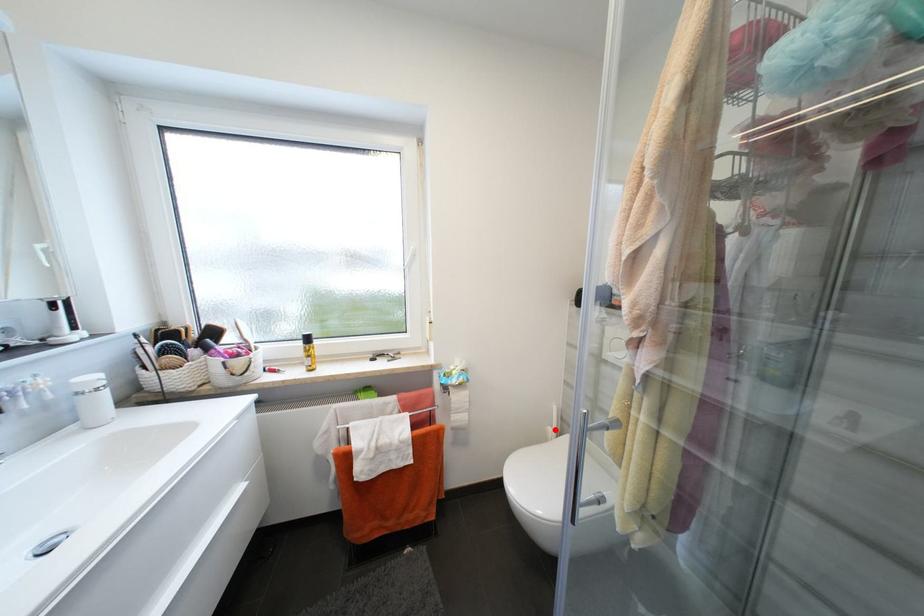
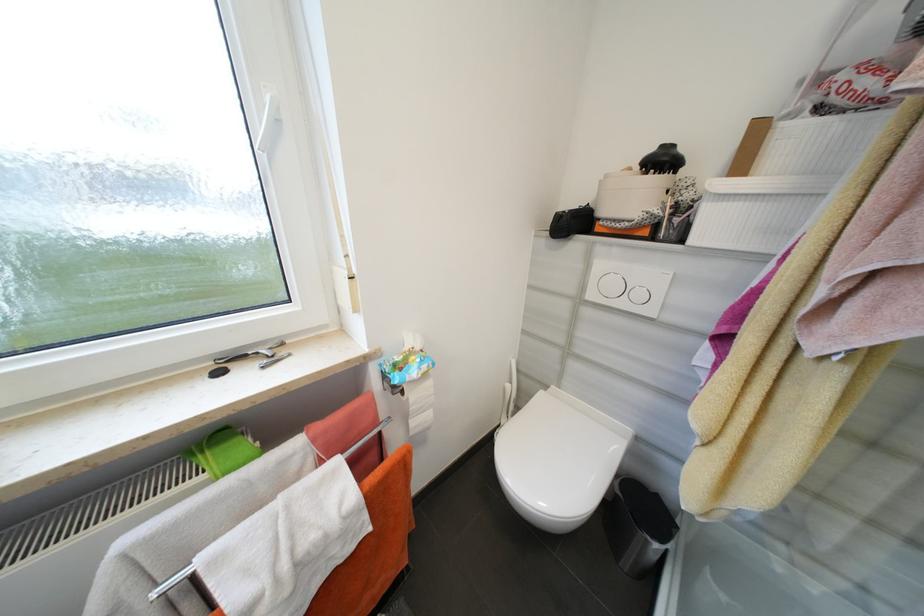
Question: I am providing you with two images of the same scene from different viewpoints. A red point is shown in image1. For the corresponding object point in image2, is it positioned nearer or farther from the camera?

Choices:
 (A) Nearer
 (B) Farther

Answer: (A)